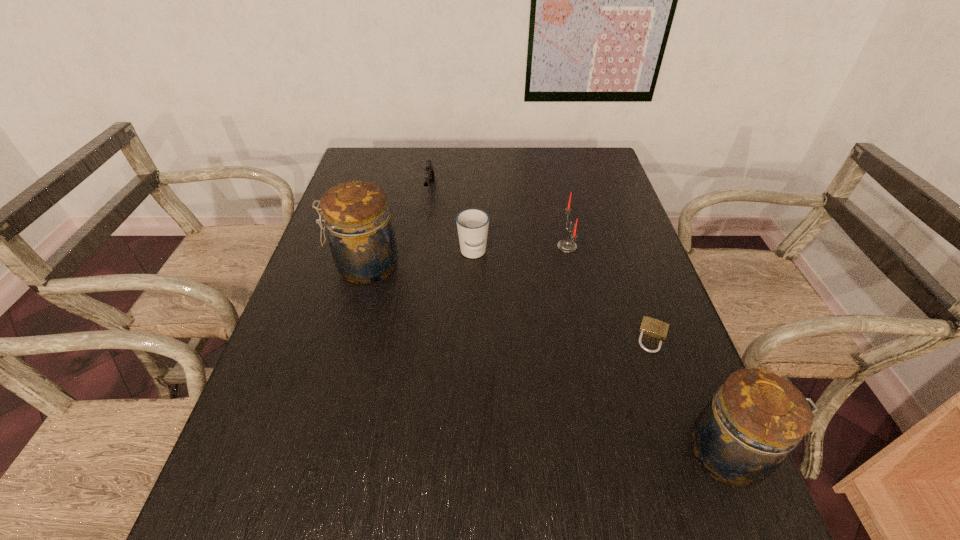
The image size is (960, 540). I want to click on unoccupied position between the second tallest object and the second object from left to right, so click(580, 322).

Image resolution: width=960 pixels, height=540 pixels. I want to click on free space between the farthest object and the second tallest object, so click(x=580, y=322).

Image resolution: width=960 pixels, height=540 pixels. I want to click on free space between the gun and the third shortest object, so [451, 221].

What are the coordinates of `free space between the farthest object and the padlock` in the screenshot? It's located at (541, 263).

I want to click on vacant area that lies between the farther jar and the second nearest object, so click(x=509, y=301).

Find the location of `unoccupied area between the cup and the left jar`. unoccupied area between the cup and the left jar is located at coordinates (420, 260).

Find the location of a particular element. The width and height of the screenshot is (960, 540). vacant space that is in between the third shortest object and the nearest object is located at coordinates (601, 353).

Locate an element on the screen. vacant region between the fourth object from right to left and the right jar is located at coordinates (601, 353).

Locate which object ranks fourth in proximity to the gun. Please provide its 2D coordinates. Your answer should be formatted as a tuple, i.e. [(x, y)], where the tuple contains the x and y coordinates of a point satisfying the conditions above.

[(652, 327)]

Identify the location of object that ranks as the fourth closest to the nearest object. (361, 238).